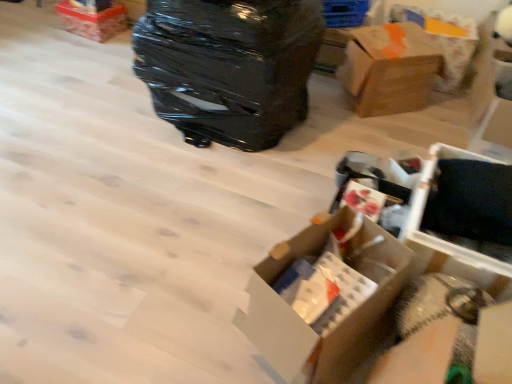
Locate an element on the screen. vacant space behind white cardboard box at center, the 1th box in the bottom-to-top sequence is located at coordinates (267, 221).